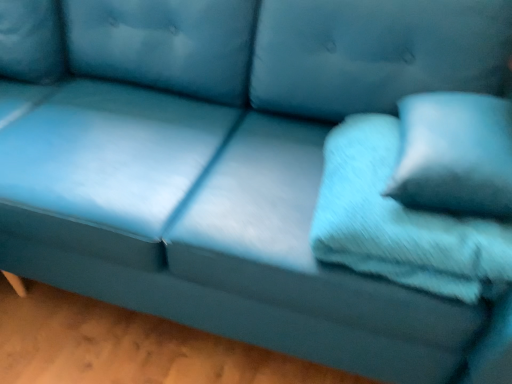
Question: Are soft blue fabric pillow at right, which is the second pillow in left-to-right order, and soft blue fabric pillow at right, acting as the 2th pillow starting from the right, far apart?

Choices:
 (A) yes
 (B) no

Answer: (B)

Question: Is soft blue fabric pillow at right, the 1th pillow viewed from the right, oriented away from soft blue fabric pillow at right, the 1th pillow viewed from the left?

Choices:
 (A) no
 (B) yes

Answer: (A)

Question: Can you confirm if soft blue fabric pillow at right, the 1th pillow viewed from the right, is bigger than soft blue fabric pillow at right, the 1th pillow viewed from the left?

Choices:
 (A) yes
 (B) no

Answer: (B)

Question: Considering the relative positions of soft blue fabric pillow at right, the 1th pillow viewed from the right, and soft blue fabric pillow at right, acting as the 2th pillow starting from the right, in the image provided, is soft blue fabric pillow at right, the 1th pillow viewed from the right, in front of soft blue fabric pillow at right, acting as the 2th pillow starting from the right,?

Choices:
 (A) no
 (B) yes

Answer: (B)

Question: From a real-world perspective, is soft blue fabric pillow at right, the 1th pillow viewed from the right, physically below soft blue fabric pillow at right, acting as the 2th pillow starting from the right?

Choices:
 (A) yes
 (B) no

Answer: (B)

Question: Can you confirm if soft blue fabric pillow at right, which is the second pillow in left-to-right order, is smaller than soft blue fabric pillow at right, the 1th pillow viewed from the left?

Choices:
 (A) no
 (B) yes

Answer: (B)

Question: Is soft blue fabric pillow at right, acting as the 2th pillow starting from the right, looking in the opposite direction of soft blue fabric pillow at right, the 1th pillow viewed from the right?

Choices:
 (A) yes
 (B) no

Answer: (B)

Question: Can you confirm if soft blue fabric pillow at right, acting as the 2th pillow starting from the right, is shorter than soft blue fabric pillow at right, the 1th pillow viewed from the right?

Choices:
 (A) yes
 (B) no

Answer: (A)

Question: Considering the relative sizes of soft blue fabric pillow at right, acting as the 2th pillow starting from the right, and soft blue fabric pillow at right, the 1th pillow viewed from the right, in the image provided, is soft blue fabric pillow at right, acting as the 2th pillow starting from the right, wider than soft blue fabric pillow at right, the 1th pillow viewed from the right,?

Choices:
 (A) no
 (B) yes

Answer: (B)

Question: From the image's perspective, would you say soft blue fabric pillow at right, the 1th pillow viewed from the left, is shown under soft blue fabric pillow at right, the 1th pillow viewed from the right?

Choices:
 (A) yes
 (B) no

Answer: (A)

Question: Can we say soft blue fabric pillow at right, acting as the 2th pillow starting from the right, lies outside soft blue fabric pillow at right, which is the second pillow in left-to-right order?

Choices:
 (A) yes
 (B) no

Answer: (A)

Question: Is soft blue fabric pillow at right, the 1th pillow viewed from the left, touching soft blue fabric pillow at right, which is the second pillow in left-to-right order?

Choices:
 (A) no
 (B) yes

Answer: (A)

Question: From a real-world perspective, relative to soft blue fabric pillow at right, the 1th pillow viewed from the left, is soft blue fabric pillow at right, the 1th pillow viewed from the right, vertically above or below?

Choices:
 (A) above
 (B) below

Answer: (A)